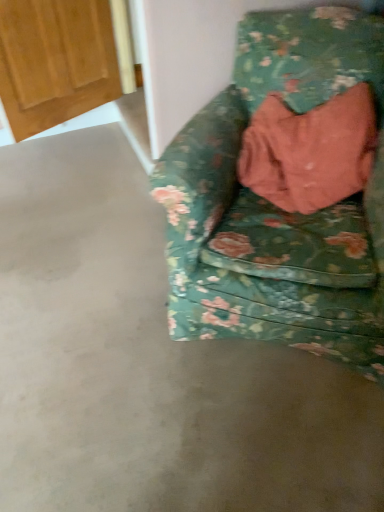
Question: From the image's perspective, relative to wooden door at upper left, is floral fabric chair at right above or below?

Choices:
 (A) above
 (B) below

Answer: (B)

Question: From a real-world perspective, is floral fabric chair at right physically located above or below wooden door at upper left?

Choices:
 (A) above
 (B) below

Answer: (B)

Question: Is point (379, 53) positioned closer to the camera than point (97, 13)?

Choices:
 (A) closer
 (B) farther

Answer: (A)

Question: Is point (11, 111) positioned closer to the camera than point (225, 306)?

Choices:
 (A) farther
 (B) closer

Answer: (A)

Question: In the image, is wooden door at upper left on the left side or the right side of floral fabric chair at right?

Choices:
 (A) right
 (B) left

Answer: (B)

Question: Considering the positions of wooden door at upper left and floral fabric chair at right in the image, is wooden door at upper left taller or shorter than floral fabric chair at right?

Choices:
 (A) tall
 (B) short

Answer: (B)

Question: From a real-world perspective, is wooden door at upper left physically located above or below floral fabric chair at right?

Choices:
 (A) below
 (B) above

Answer: (B)